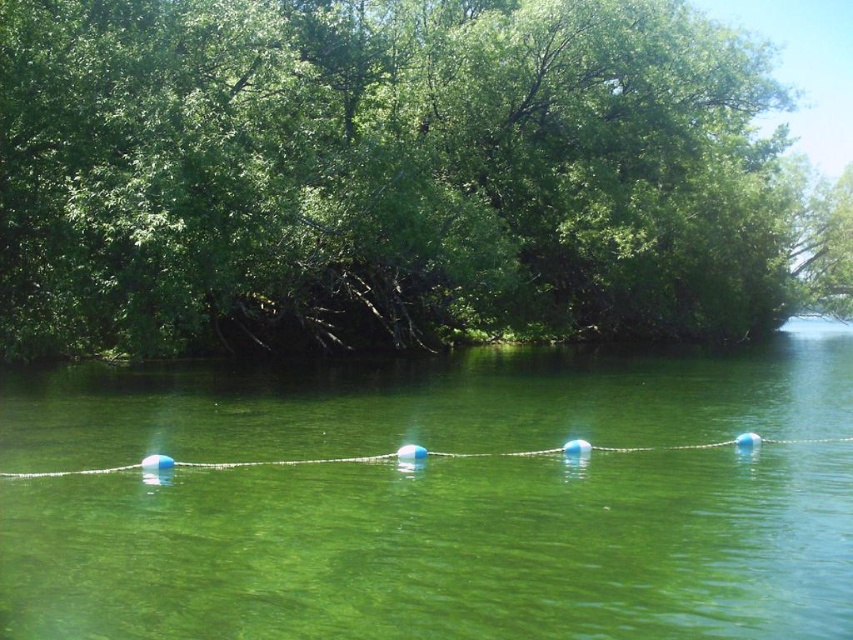
Question: Which point appears farthest from the camera in this image?

Choices:
 (A) (273, 552)
 (B) (33, 173)

Answer: (B)

Question: Can you confirm if green leafy tree at center is smaller than blue rubber buoy at center?

Choices:
 (A) yes
 (B) no

Answer: (B)

Question: Among these points, which one is nearest to the camera?

Choices:
 (A) (670, 284)
 (B) (709, 369)

Answer: (B)

Question: Is green leafy tree at center below blue rubber buoy at center?

Choices:
 (A) no
 (B) yes

Answer: (A)

Question: Can you confirm if green leafy tree at center is wider than blue rubber buoy at center?

Choices:
 (A) yes
 (B) no

Answer: (A)